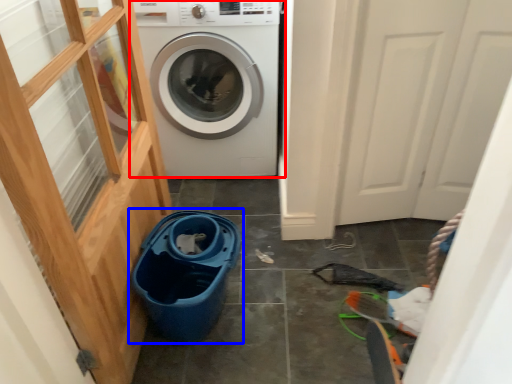
Question: Which point is closer to the camera, washing machine (highlighted by a red box) or recycling bin (highlighted by a blue box)?

Choices:
 (A) washing machine
 (B) recycling bin

Answer: (B)